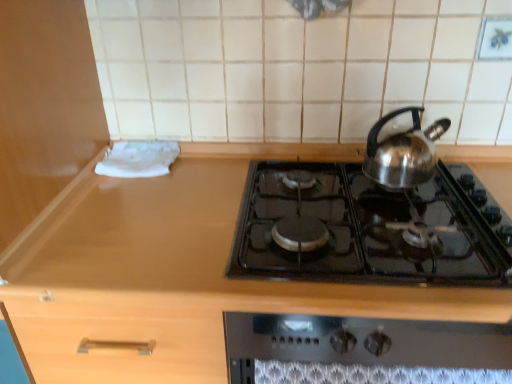
Question: Is shiny metallic kettle at upper right with black glass gas stove at center?

Choices:
 (A) yes
 (B) no

Answer: (B)

Question: Is shiny metallic kettle at upper right shorter than black glass gas stove at center?

Choices:
 (A) no
 (B) yes

Answer: (A)

Question: Could you tell me if shiny metallic kettle at upper right is turned towards black glass gas stove at center?

Choices:
 (A) no
 (B) yes

Answer: (A)

Question: From the image's perspective, is shiny metallic kettle at upper right under black glass gas stove at center?

Choices:
 (A) yes
 (B) no

Answer: (B)

Question: Is shiny metallic kettle at upper right outside of black glass gas stove at center?

Choices:
 (A) yes
 (B) no

Answer: (A)

Question: Is wooden counter at center wider or thinner than black glass gas stove at center?

Choices:
 (A) thin
 (B) wide

Answer: (B)

Question: From a real-world perspective, is wooden counter at center physically located above or below black glass gas stove at center?

Choices:
 (A) above
 (B) below

Answer: (B)

Question: Considering the positions of point (358, 292) and point (268, 188), is point (358, 292) closer or farther from the camera than point (268, 188)?

Choices:
 (A) farther
 (B) closer

Answer: (B)

Question: Is wooden counter at center bigger or smaller than black glass gas stove at center?

Choices:
 (A) big
 (B) small

Answer: (A)

Question: In terms of height, does shiny metallic kettle at upper right look taller or shorter compared to black glass gas stove at center?

Choices:
 (A) tall
 (B) short

Answer: (A)

Question: Is shiny metallic kettle at upper right to the left or to the right of black glass gas stove at center in the image?

Choices:
 (A) left
 (B) right

Answer: (B)

Question: In terms of width, does shiny metallic kettle at upper right look wider or thinner when compared to black glass gas stove at center?

Choices:
 (A) wide
 (B) thin

Answer: (B)

Question: Considering the positions of point click(379, 129) and point click(407, 246), is point click(379, 129) closer or farther from the camera than point click(407, 246)?

Choices:
 (A) farther
 (B) closer

Answer: (A)

Question: From a real-world perspective, is shiny metallic kettle at upper right physically located above or below wooden counter at center?

Choices:
 (A) above
 (B) below

Answer: (A)

Question: Would you say shiny metallic kettle at upper right is inside or outside wooden counter at center?

Choices:
 (A) outside
 (B) inside

Answer: (A)